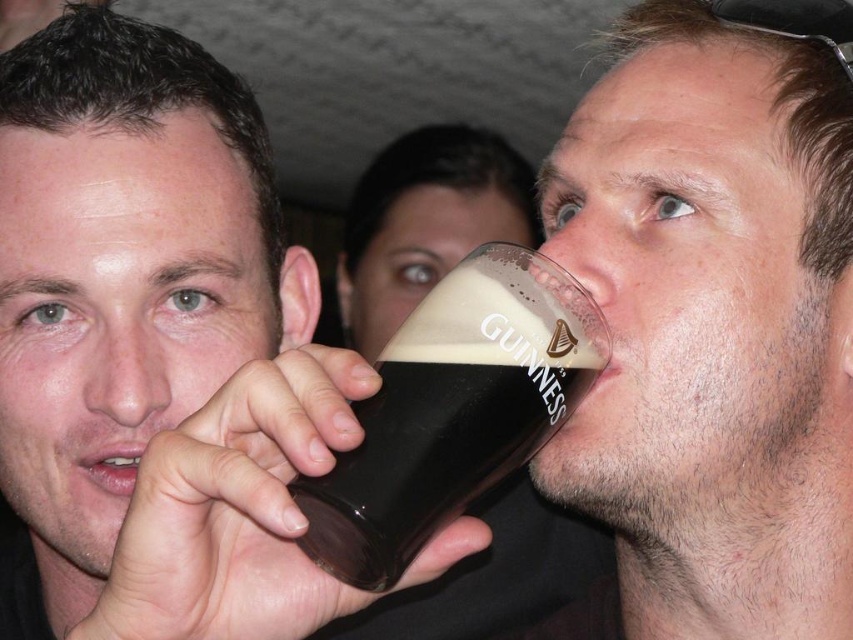
Does dark glass at center have a lesser height compared to dark glass/matte guinness pint at center?

No.

The image size is (853, 640). Describe the element at coordinates (135, 308) in the screenshot. I see `dark glass at center` at that location.

Find the location of a particular element. The width and height of the screenshot is (853, 640). dark glass at center is located at coordinates (135, 308).

Between dark glass at upper right and dark glass/matte guinness pint at center, which one appears on the left side from the viewer's perspective?

dark glass/matte guinness pint at center is more to the left.

Who is lower down, dark glass at upper right or dark glass/matte guinness pint at center?

dark glass/matte guinness pint at center

Image resolution: width=853 pixels, height=640 pixels. Describe the element at coordinates (712, 326) in the screenshot. I see `dark glass at upper right` at that location.

I want to click on dark glass at upper right, so click(x=712, y=326).

Is dark glass at upper right shorter than dark glass at center?

Yes, dark glass at upper right is shorter than dark glass at center.

The image size is (853, 640). Find the location of `dark glass at upper right`. dark glass at upper right is located at coordinates (712, 326).

Image resolution: width=853 pixels, height=640 pixels. In order to click on dark glass at upper right in this screenshot , I will do `click(712, 326)`.